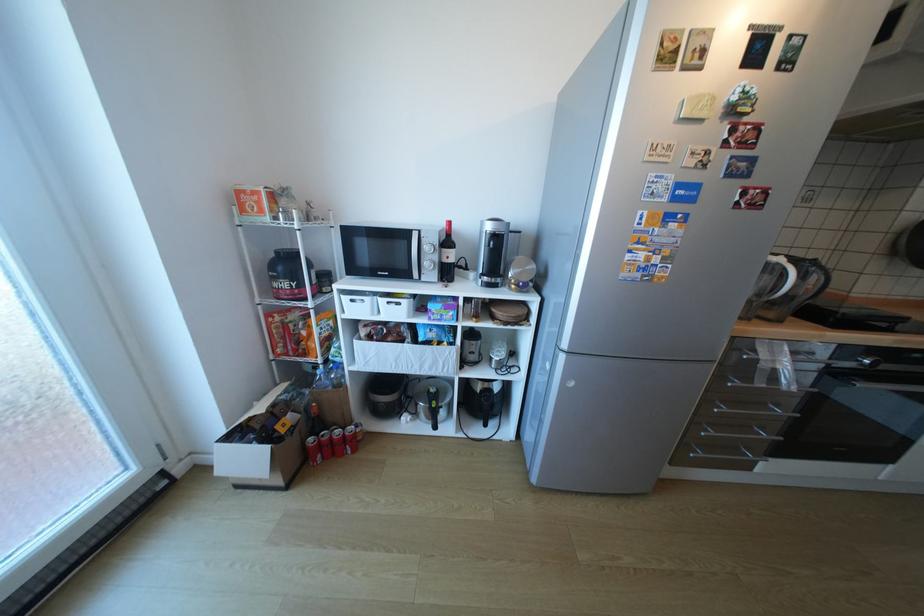
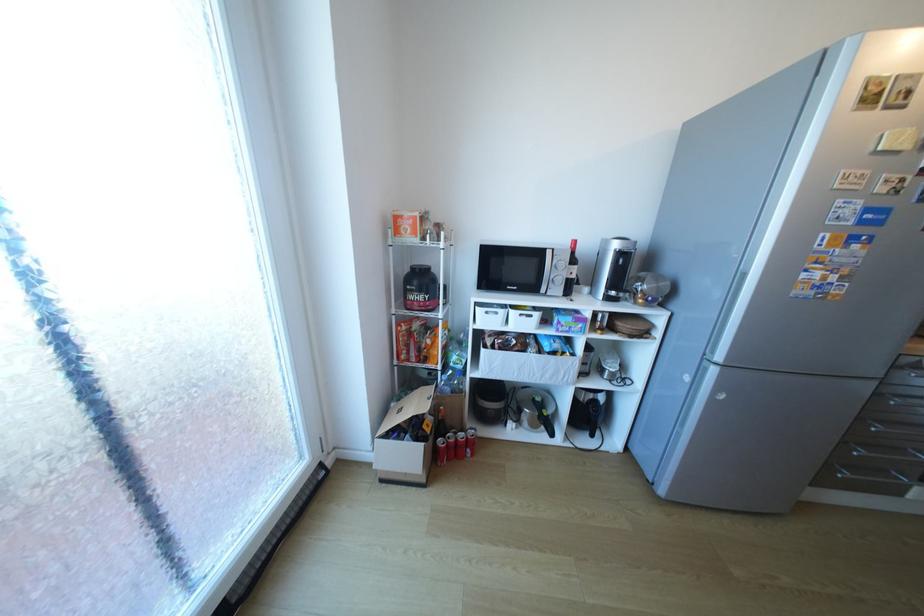
Find the pixel in the second image that matches (x=431, y=267) in the first image.

(560, 282)